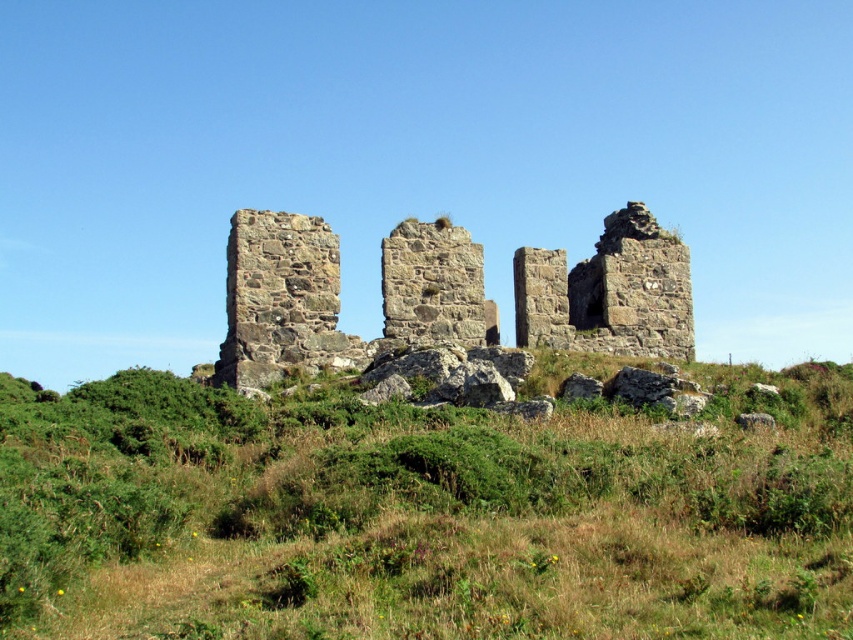
Question: Is green grassy at center in front of rustic stone ruins at center?

Choices:
 (A) yes
 (B) no

Answer: (A)

Question: Which object appears farthest from the camera in this image?

Choices:
 (A) rustic stone ruins at center
 (B) green grassy at center

Answer: (A)

Question: Is green grassy at center behind rustic stone ruins at center?

Choices:
 (A) yes
 (B) no

Answer: (B)

Question: Which of the following is the farthest from the observer?

Choices:
 (A) rustic stone ruins at center
 (B) green grassy at center

Answer: (A)

Question: Which of the following is the farthest from the observer?

Choices:
 (A) (668, 275)
 (B) (495, 477)

Answer: (A)

Question: Does green grassy at center have a lesser width compared to rustic stone ruins at center?

Choices:
 (A) yes
 (B) no

Answer: (B)